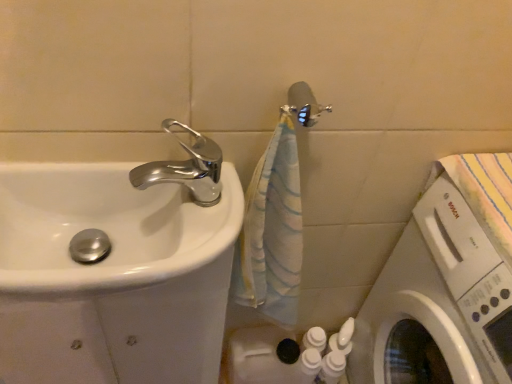
Question: Based on their positions, is white glossy sink at left located to the left or right of white glossy washing machine at lower right?

Choices:
 (A) left
 (B) right

Answer: (A)

Question: From a real-world perspective, is white glossy sink at left above or below white glossy washing machine at lower right?

Choices:
 (A) below
 (B) above

Answer: (A)

Question: Estimate the real-world distances between objects in this image. Which object is closer to the metallic silver shower head at upper center?

Choices:
 (A) chrome metallic faucet at upper left
 (B) white glossy washing machine at lower right
 (C) white glossy sink at left

Answer: (A)

Question: Which of these objects is positioned farthest from the metallic silver shower head at upper center?

Choices:
 (A) chrome metallic faucet at upper left
 (B) white glossy sink at left
 (C) white glossy washing machine at lower right

Answer: (C)